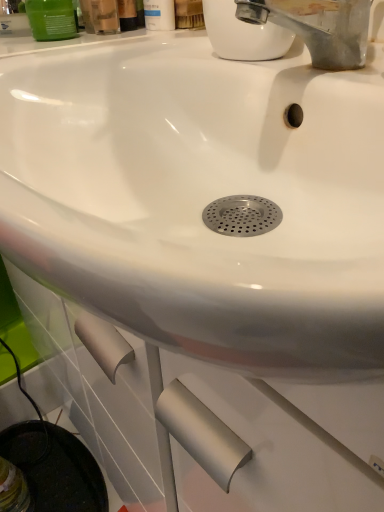
Question: From a real-world perspective, is green matte container at upper left, marked as the 3th mouthwash in a right-to-left arrangement, on white matte bottle at upper center, placed as the third mouthwash when sorted from left to right?

Choices:
 (A) yes
 (B) no

Answer: (B)

Question: Is green matte container at upper left, the 1th mouthwash positioned from the left, next to white matte bottle at upper center, placed as the third mouthwash when sorted from left to right?

Choices:
 (A) yes
 (B) no

Answer: (B)

Question: Is white matte bottle at upper center, the 1th mouthwash when ordered from right to left, at the back of green matte container at upper left, the 1th mouthwash positioned from the left?

Choices:
 (A) no
 (B) yes

Answer: (B)

Question: From the image's perspective, does green matte container at upper left, marked as the 3th mouthwash in a right-to-left arrangement, appear higher than white matte bottle at upper center, placed as the third mouthwash when sorted from left to right?

Choices:
 (A) no
 (B) yes

Answer: (A)

Question: Is the depth of green matte container at upper left, marked as the 3th mouthwash in a right-to-left arrangement, greater than that of white matte bottle at upper center, placed as the third mouthwash when sorted from left to right?

Choices:
 (A) no
 (B) yes

Answer: (A)

Question: Is matte plastic mouthwash at upper center, arranged as the 2th mouthwash when viewed from the right, taller or shorter than white matte bottle at upper center, the 1th mouthwash when ordered from right to left?

Choices:
 (A) short
 (B) tall

Answer: (A)

Question: Which is correct: matte plastic mouthwash at upper center, positioned as the second mouthwash in left-to-right order, is inside white matte bottle at upper center, placed as the third mouthwash when sorted from left to right, or outside of it?

Choices:
 (A) outside
 (B) inside

Answer: (A)

Question: From a real-world perspective, is matte plastic mouthwash at upper center, positioned as the second mouthwash in left-to-right order, physically located above or below white matte bottle at upper center, placed as the third mouthwash when sorted from left to right?

Choices:
 (A) below
 (B) above

Answer: (A)

Question: Relative to white matte bottle at upper center, the 1th mouthwash when ordered from right to left, is matte plastic mouthwash at upper center, positioned as the second mouthwash in left-to-right order, in front or behind?

Choices:
 (A) front
 (B) behind

Answer: (A)

Question: Is green matte container at upper left, the 1th mouthwash positioned from the left, in front of or behind matte plastic mouthwash at upper center, positioned as the second mouthwash in left-to-right order, in the image?

Choices:
 (A) behind
 (B) front

Answer: (A)

Question: In the image, is green matte container at upper left, marked as the 3th mouthwash in a right-to-left arrangement, on the left side or the right side of matte plastic mouthwash at upper center, arranged as the 2th mouthwash when viewed from the right?

Choices:
 (A) left
 (B) right

Answer: (A)

Question: Is green matte container at upper left, marked as the 3th mouthwash in a right-to-left arrangement, taller or shorter than matte plastic mouthwash at upper center, arranged as the 2th mouthwash when viewed from the right?

Choices:
 (A) short
 (B) tall

Answer: (A)

Question: In terms of size, does green matte container at upper left, the 1th mouthwash positioned from the left, appear bigger or smaller than matte plastic mouthwash at upper center, arranged as the 2th mouthwash when viewed from the right?

Choices:
 (A) small
 (B) big

Answer: (A)

Question: From a real-world perspective, is white matte bottle at upper center, the 1th mouthwash when ordered from right to left, positioned above or below green matte container at upper left, the 1th mouthwash positioned from the left?

Choices:
 (A) below
 (B) above

Answer: (B)

Question: From the image's perspective, is white matte bottle at upper center, the 1th mouthwash when ordered from right to left, above or below green matte container at upper left, marked as the 3th mouthwash in a right-to-left arrangement?

Choices:
 (A) above
 (B) below

Answer: (A)